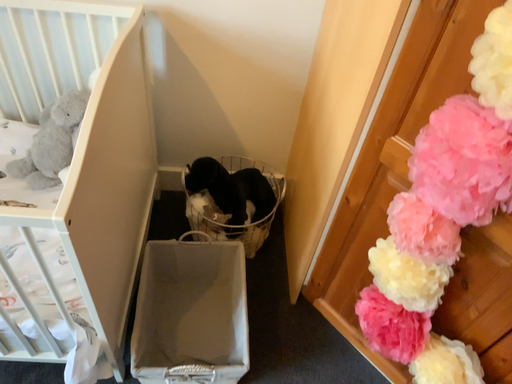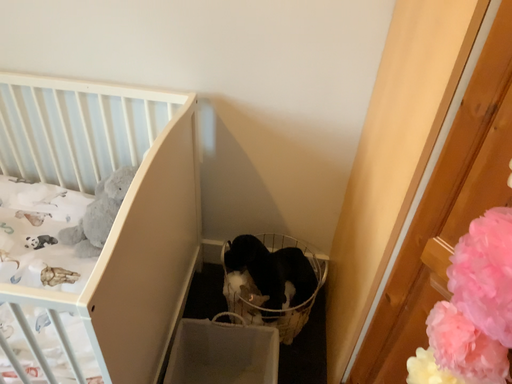
Question: Which way did the camera rotate in the video?

Choices:
 (A) rotated upward
 (B) rotated downward

Answer: (A)